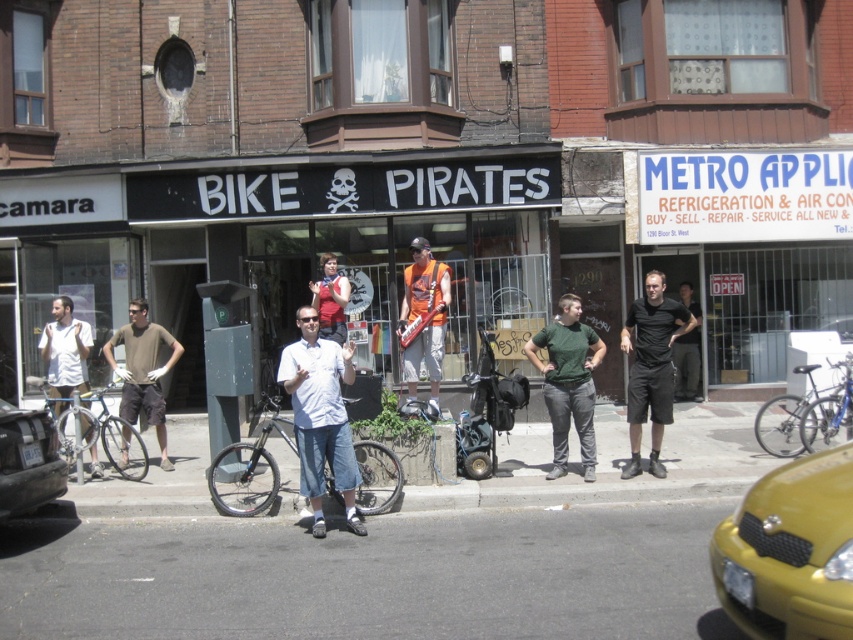
Is point (795, 442) positioned after point (426, 368)?

No, (795, 442) is closer to viewer.

Can you confirm if blue metallic bicycle at center is positioned above orange fabric guitar at center?

Incorrect, blue metallic bicycle at center is not positioned above orange fabric guitar at center.

Is point (827, 432) more distant than point (433, 378)?

No, (827, 432) is closer to viewer.

Find the location of a particular element. blue metallic bicycle at center is located at coordinates (807, 416).

Who is taller, white matte shirt at center or green matte shirt at center?

white matte shirt at center

Which is more to the left, white matte shirt at center or green matte shirt at center?

white matte shirt at center is more to the left.

Locate an element on the screen. white matte shirt at center is located at coordinates (320, 417).

The height and width of the screenshot is (640, 853). What are the coordinates of `white matte shirt at center` in the screenshot? It's located at (320, 417).

Can you confirm if brown cotton shirt at left is wider than matte red shirt at center?

Yes.

Between brown cotton shirt at left and matte red shirt at center, which one is positioned higher?

matte red shirt at center

Is point (165, 458) farther from camera compared to point (326, 272)?

No, (165, 458) is in front of (326, 272).

At what (x,y) coordinates should I click in order to perform the action: click on brown cotton shirt at left. Please return your answer as a coordinate pair (x, y). The width and height of the screenshot is (853, 640). Looking at the image, I should click on (143, 371).